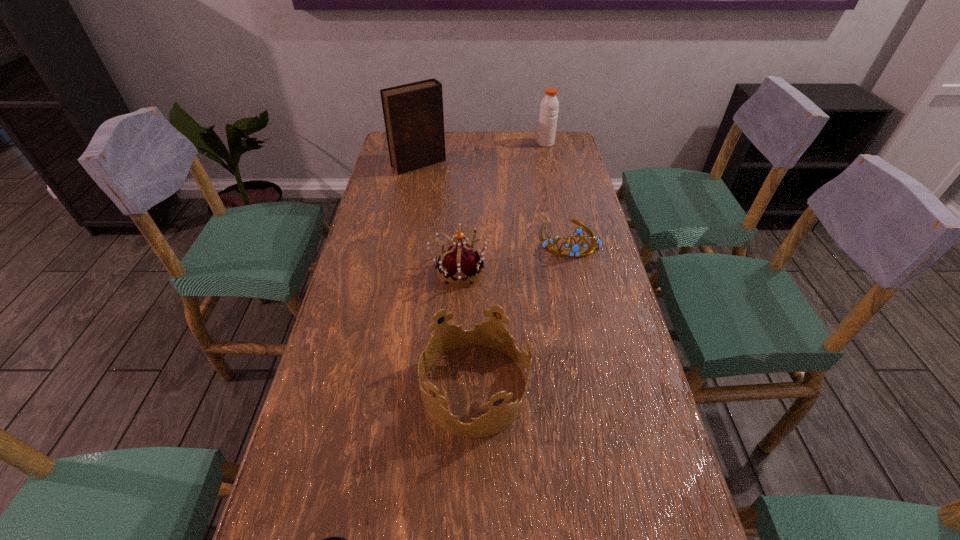
Locate an element on the screen. free region located 0.380m on the front-facing side of the shortest tiara is located at coordinates (599, 372).

Find the location of `Bible that is at the far edge`. Bible that is at the far edge is located at coordinates (413, 113).

The image size is (960, 540). What are the coordinates of `shaker at the far edge` in the screenshot? It's located at (549, 107).

Locate an element on the screen. object located in the left edge section of the desktop is located at coordinates (413, 113).

Image resolution: width=960 pixels, height=540 pixels. Identify the location of shaker at the right edge. (549, 107).

Find the location of `tiara that is at the right edge`. tiara that is at the right edge is located at coordinates (575, 248).

The width and height of the screenshot is (960, 540). In order to click on object that is at the far left corner in this screenshot , I will do `click(413, 113)`.

Where is `object that is at the far right corner`? This screenshot has height=540, width=960. object that is at the far right corner is located at coordinates (549, 107).

I want to click on vacant area at the far edge of the desktop, so click(501, 135).

Locate an element on the screen. The image size is (960, 540). vacant space at the left edge is located at coordinates (362, 256).